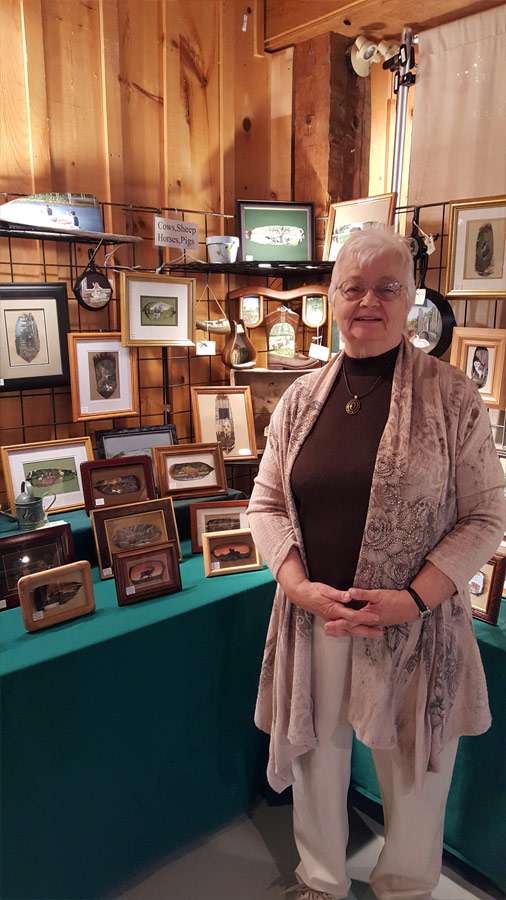
Where is `table`? table is located at coordinates (190, 745).